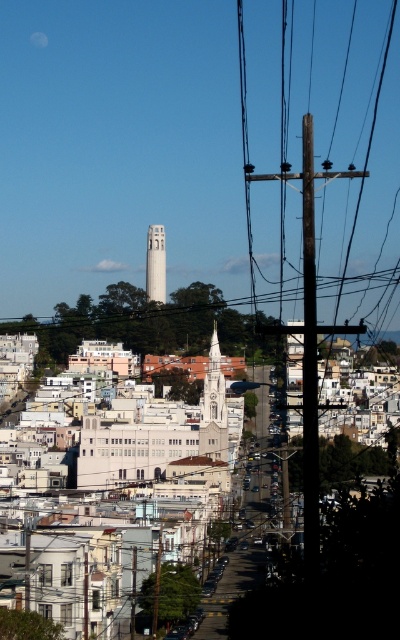
Consider the image. You are a city planner assessing the layout of this urban area. You need to determine which pole is closer to the main road for maintenance purposes. The wooden pole at right and the dark brown wooden telegraph pole at center are both visible. Which pole is closer to the main road?

The wooden pole at right is closer to the main road because it is further to the viewer than the dark brown wooden telegraph pole at center, indicating it is positioned nearer to the road where maintenance access is required.

You are a city planner reviewing this area. You need to install a new streetlight between the wooden pole at right and the white concrete tower at center. Which object will the new streetlight be closer to?

The new streetlight will be closer to the wooden pole at right because it is nearer to the viewer compared to the white concrete tower at center.

You are a city planner assessing the width of structures for a new project. You observe the wooden pole at right and the white stone clock tower at center. Which structure has a greater width according to the scene?

The wooden pole at right might be wider than white stone clock tower at center, so the wooden pole at right has a greater width according to the scene.